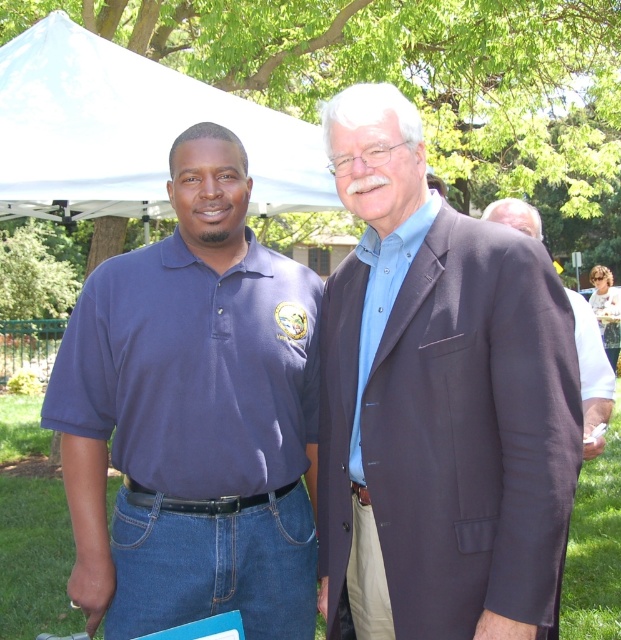
You are a photographer trying to capture a photo of the matte blue polo shirt at left and the white fabric canopy at upper center. Which object is closer to the right edge of the frame?

The matte blue polo shirt at left is positioned on the right side of the white fabric canopy at upper center, so it is closer to the right edge of the frame.

You are a photographer taking a photo of two men. You need to ensure that the blue cotton shirt at center and the matte blue polo shirt at left are both in the frame. Based on their positions, which shirt should you focus on first to capture both in the shot?

The blue cotton shirt at center is to the right of the matte blue polo shirt at left, so focusing on the matte blue polo shirt at left first would ensure both shirts are included in the frame since the blue cotton shirt at center is positioned to its right.

You are a photographer trying to capture a clear image of the white fabric canopy at upper center. You notice the matte blue polo shirt at left in the foreground. Considering their thickness, which object would be more challenging to focus on due to its smaller size?

The matte blue polo shirt at left is thinner than the white fabric canopy at upper center, so it would be more challenging to focus on the matte blue polo shirt at left due to its smaller size.